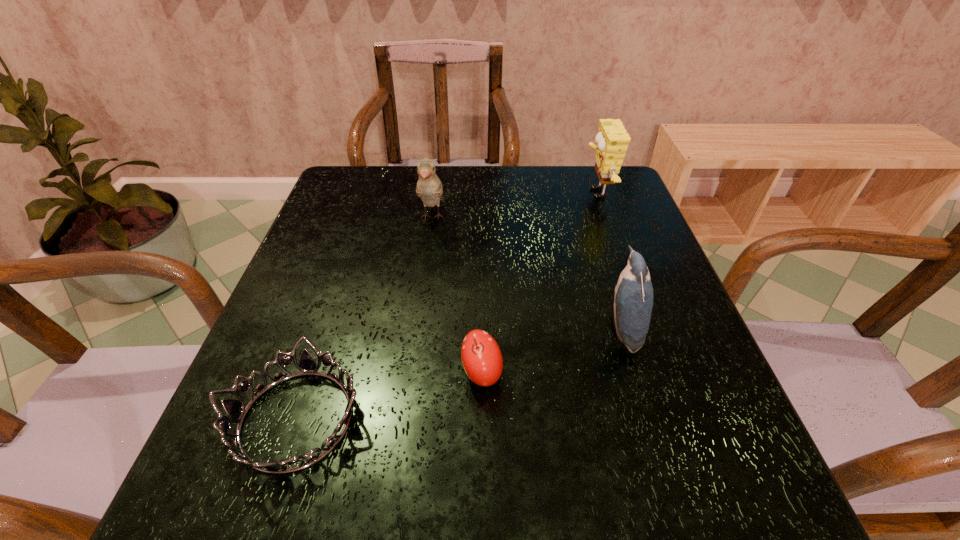
Locate an element on the screen. The image size is (960, 540). unoccupied area between the second object from left to right and the shortest object is located at coordinates (364, 318).

At what (x,y) coordinates should I click in order to perform the action: click on free spot between the nearer bird and the fourth object from right to left. Please return your answer as a coordinate pair (x, y). The width and height of the screenshot is (960, 540). Looking at the image, I should click on (526, 273).

Where is `object that stands as the third closest to the farther bird`? object that stands as the third closest to the farther bird is located at coordinates (235, 409).

Select which object is the closest to the third object from left to right. Please provide its 2D coordinates. Your answer should be formatted as a tuple, i.e. [(x, y)], where the tuple contains the x and y coordinates of a point satisfying the conditions above.

[(235, 409)]

The height and width of the screenshot is (540, 960). In order to click on blank space that satisfies the following two spatial constraints: 1. at the face of the apple; 2. on the left side of the second object from left to right in this screenshot , I will do `click(411, 374)`.

Locate an element on the screen. Image resolution: width=960 pixels, height=540 pixels. vacant region that satisfies the following two spatial constraints: 1. at the face of the fourth object from right to left; 2. on the right side of the third object from right to left is located at coordinates (411, 374).

The height and width of the screenshot is (540, 960). I want to click on vacant space that satisfies the following two spatial constraints: 1. at the face of the second object from left to right; 2. on the right side of the apple, so pyautogui.click(x=411, y=374).

Locate an element on the screen. free spot that satisfies the following two spatial constraints: 1. at the face of the farther bird; 2. on the right side of the second shortest object is located at coordinates (411, 374).